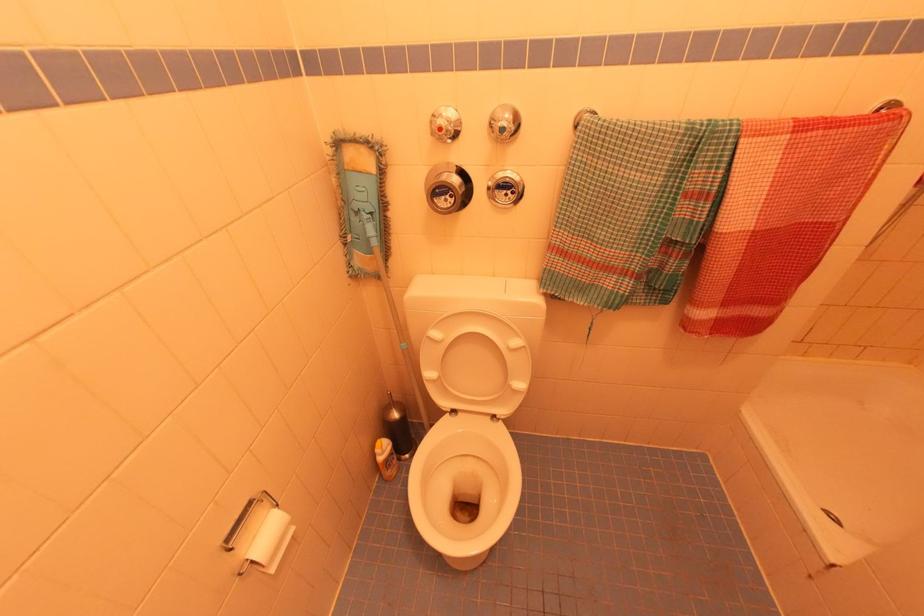
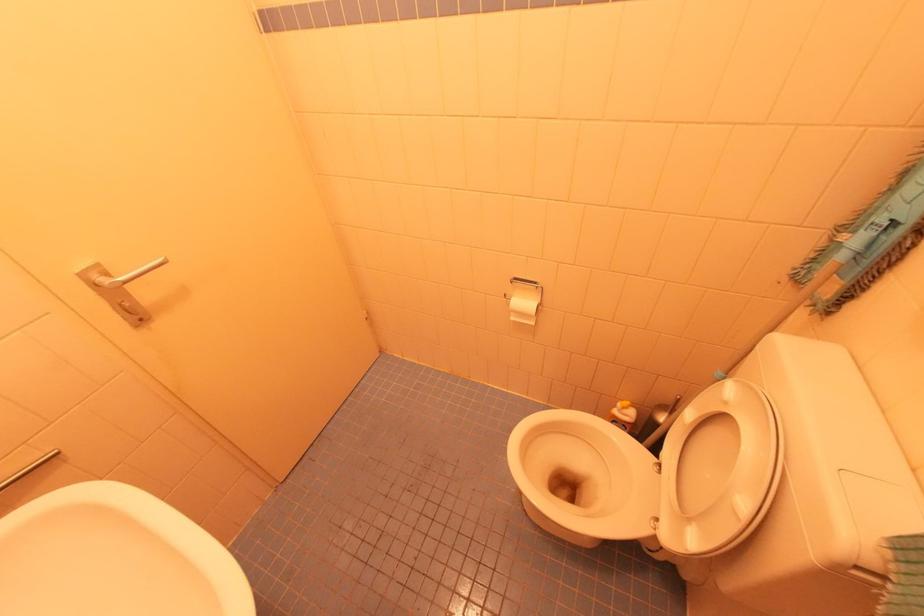
Based on the continuous images, in which direction is the camera rotating?

The camera rotated toward left-down.